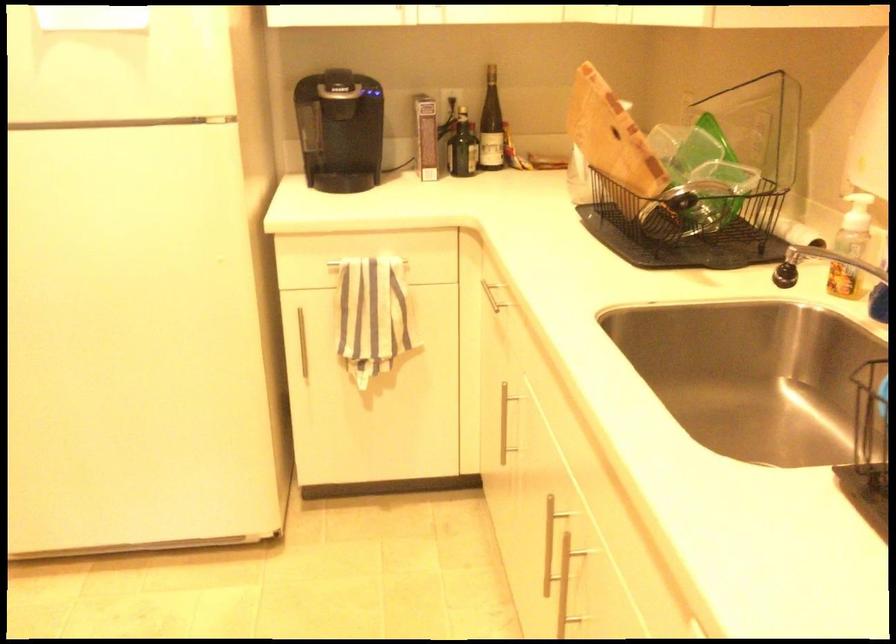
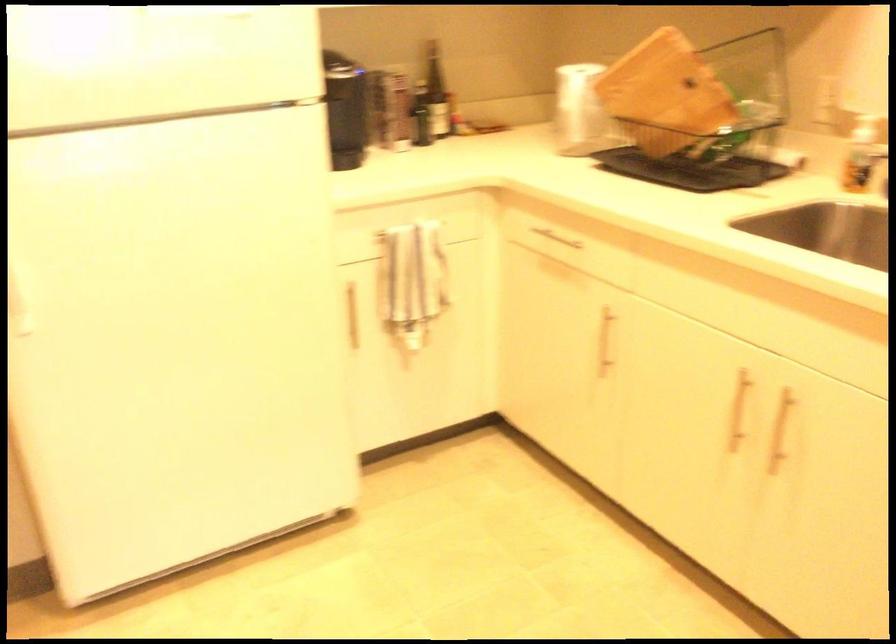
Find the pixel in the second image that matches point 502,124 in the first image.

(435, 91)